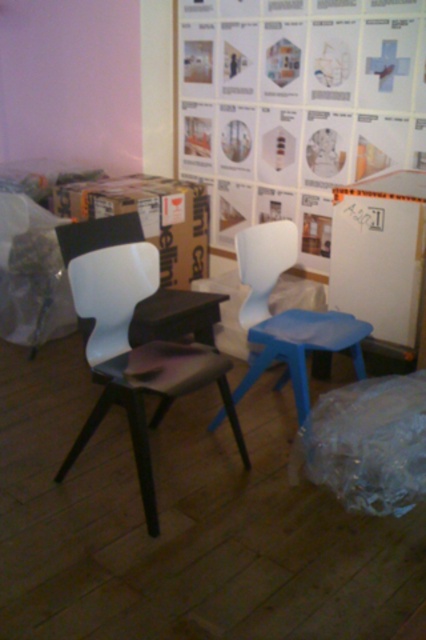
Is transparent plastic bag at lower right shorter than white plastic chair at center?

Correct, transparent plastic bag at lower right is not as tall as white plastic chair at center.

Is transparent plastic bag at lower right wider than white plastic chair at center?

Incorrect, transparent plastic bag at lower right's width does not surpass white plastic chair at center's.

Is point (383, 440) in front of point (273, 275)?

Yes, point (383, 440) is in front of point (273, 275).

The height and width of the screenshot is (640, 426). What are the coordinates of `transparent plastic bag at lower right` in the screenshot? It's located at (367, 444).

Can you confirm if white paper at upper center is positioned to the right of black matte table at center?

Indeed, white paper at upper center is positioned on the right side of black matte table at center.

Is white paper at upper center smaller than black matte table at center?

No, white paper at upper center is not smaller than black matte table at center.

Where is `white paper at upper center`? This screenshot has height=640, width=426. white paper at upper center is located at coordinates (296, 106).

You are a GUI agent. You are given a task and a screenshot of the screen. Output one action in this format:
    pyautogui.click(x=<x>, y=<y>)
    Task: Click on the white paper at upper center
    The height and width of the screenshot is (640, 426).
    Given the screenshot: What is the action you would take?
    pyautogui.click(x=296, y=106)

Is white paper at upper center above transparent plastic bag at lower right?

Correct, white paper at upper center is located above transparent plastic bag at lower right.

Measure the distance between point (239, 189) and camera.

Point (239, 189) is 3.65 meters away from camera.

Is point (210, 157) positioned behind point (331, 396)?

Yes, it is behind point (331, 396).

Locate an element on the screen. white paper at upper center is located at coordinates (296, 106).